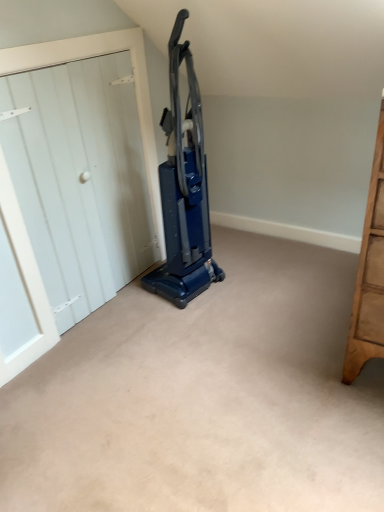
Locate an element on the screen. This screenshot has height=512, width=384. unoccupied area in front of blue plastic vacuum cleaner at center is located at coordinates (189, 321).